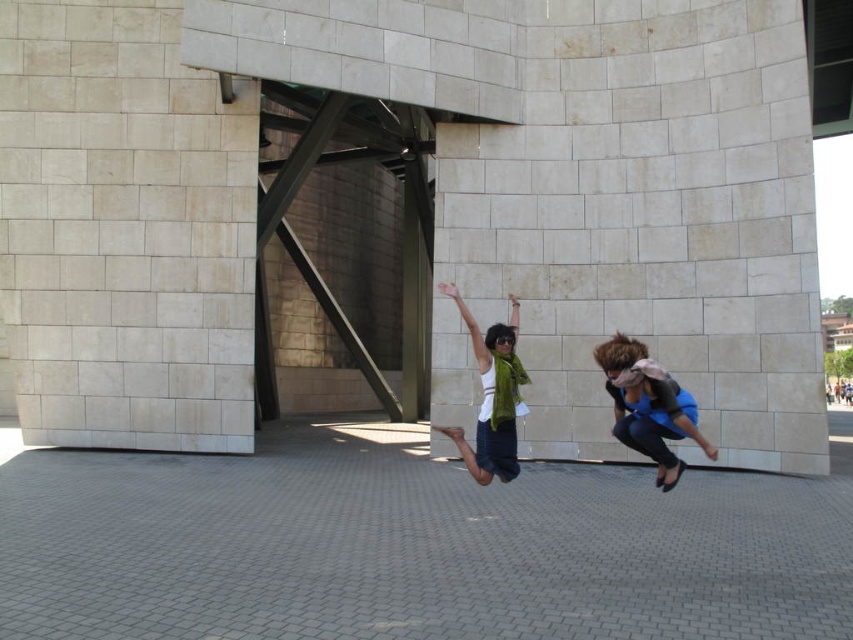
You are a photographer trying to capture a shot of the beige stone pillar at lower left and the green scarf at center from a drone. The drone has a minimum focus distance of 10 meters. Will the drone be able to focus on both objects simultaneously?

The distance between the beige stone pillar at lower left and the green scarf at center is 15.11 meters. Since the drone requires a minimum focus distance of 10 meters, it can focus on both objects as they are within the required range.

You are standing at the origin point of the image coordinate system. You see two points, point (61,128) and point (691,412). Which point is closer to you?

Point (691,412) is closer to you because it is in front of point (61,128).

You are a photographer trying to capture a photo of the blue fabric at center and the green scarf at center. If your camera has a maximum focus range of 3 meters, can you focus on both objects simultaneously?

The distance between the blue fabric at center and green scarf at center is 3.27 meters. Since the camera can only focus within 3 meters, the objects are too far apart for the camera to focus on both at the same time.